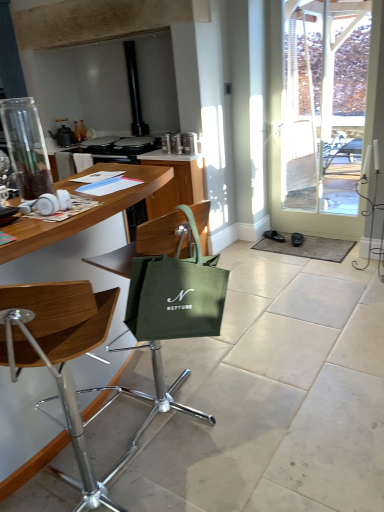
Where is `vacant area that lies between wooden at left, arranged as the first chair when viewed from the front, and green fabric bag at center, acting as the 1th chair starting from the back`? This screenshot has height=512, width=384. vacant area that lies between wooden at left, arranged as the first chair when viewed from the front, and green fabric bag at center, acting as the 1th chair starting from the back is located at coordinates (171, 462).